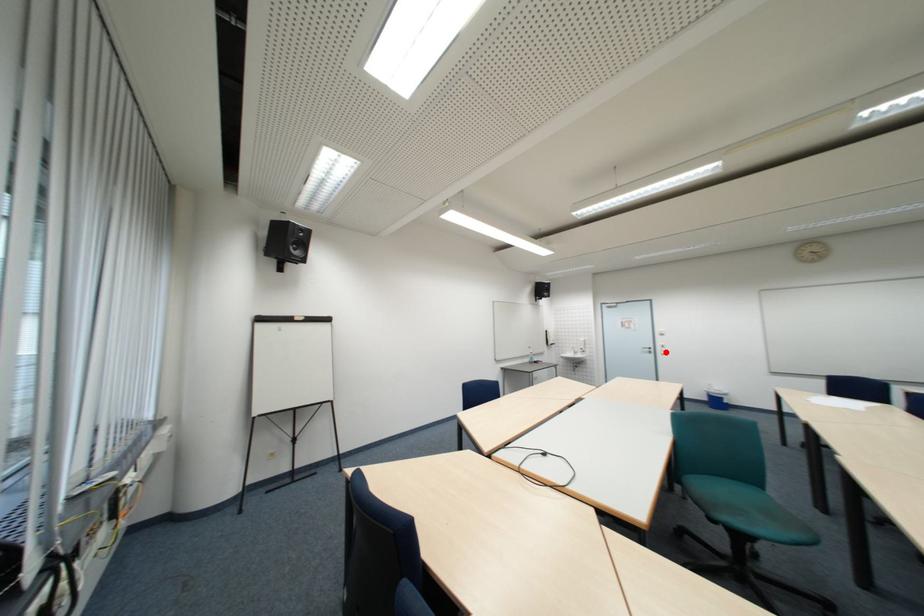
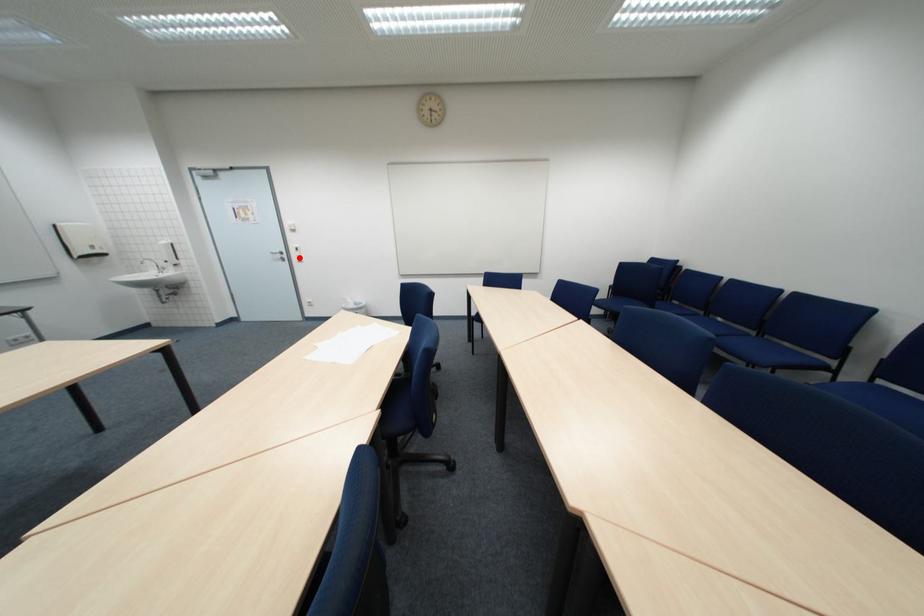
I am providing you with two images of the same scene from different viewpoints. A red point is marked on the first image and another point is marked on the second image. Is the marked point in image1 the same physical position as the marked point in image2?

Yes